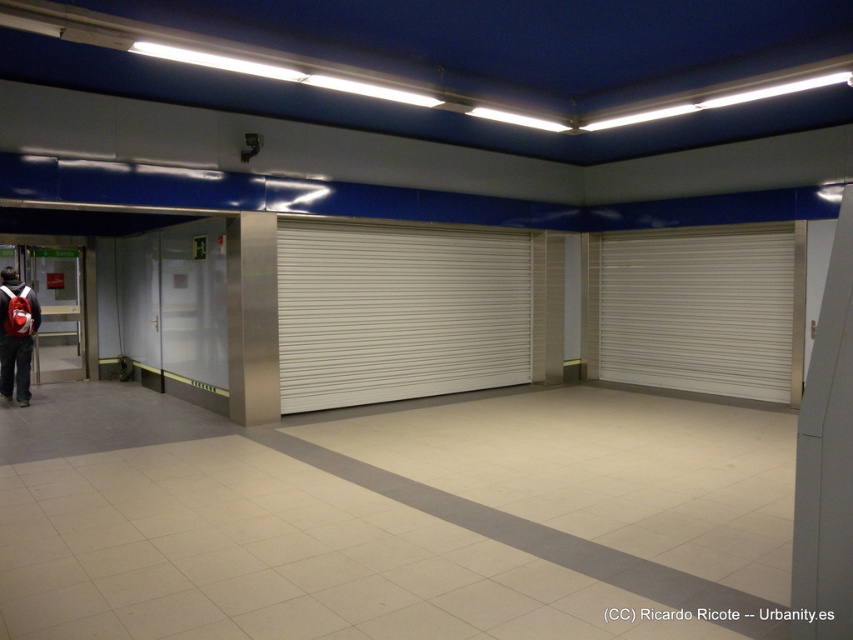
You are a delivery person who needs to place a package on the floor between the white metallic blind at center and the matte red backpack at lower left. What is the minimum distance you need to walk to reach the closest object?

The minimum distance you need to walk is 0 meters because you can place the package right next to either the white metallic blind at center or the matte red backpack at lower left without moving.